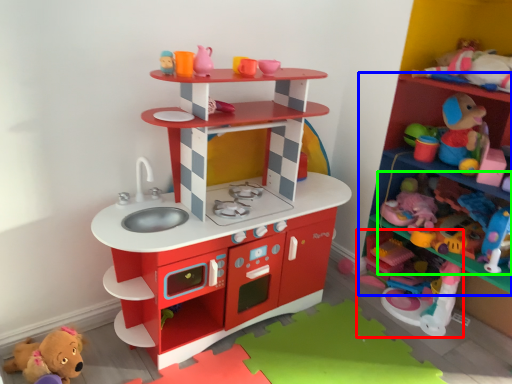
Question: Considering the real-world distances, which object is closest to toy (highlighted by a red box)? shelf (highlighted by a blue box) or toy (highlighted by a green box).

Choices:
 (A) shelf
 (B) toy

Answer: (B)